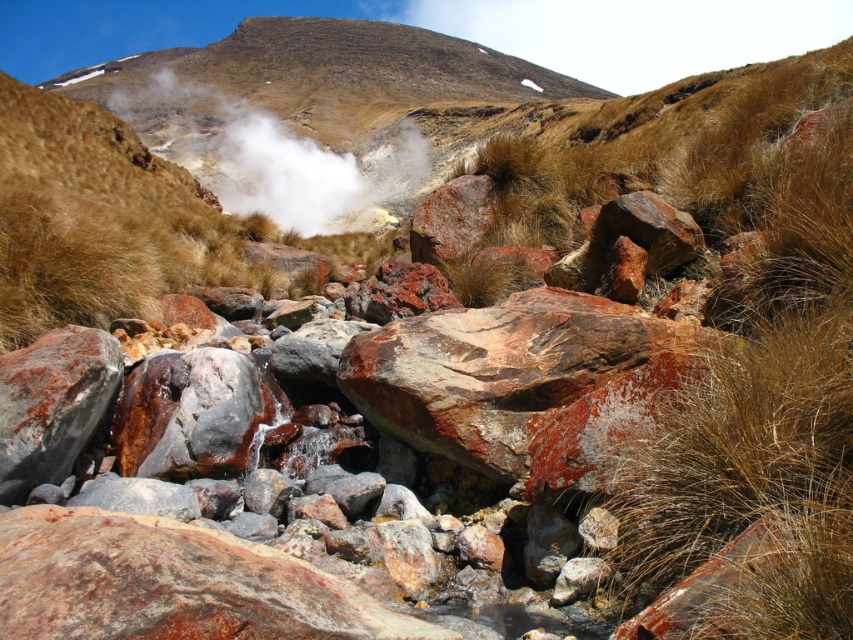
Question: Which point is closer to the camera?

Choices:
 (A) (134, 124)
 (B) (587, 406)

Answer: (B)

Question: From the image, what is the correct spatial relationship of rusty rock at center in relation to white vapor at center?

Choices:
 (A) below
 (B) above

Answer: (A)

Question: Is rusty rock at center positioned at the back of white vapor at center?

Choices:
 (A) yes
 (B) no

Answer: (B)

Question: Which object is closer to the camera taking this photo?

Choices:
 (A) white vapor at center
 (B) rusty rock at center

Answer: (B)

Question: Is the position of rusty rock at center more distant than that of white vapor at center?

Choices:
 (A) no
 (B) yes

Answer: (A)